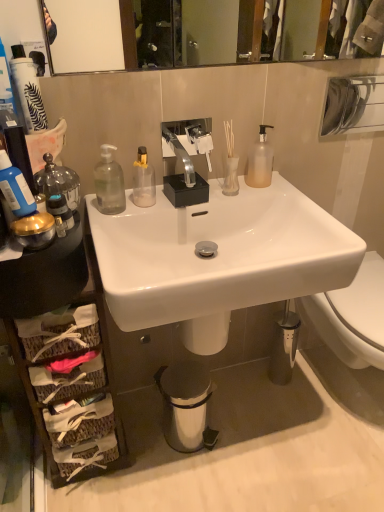
Locate an element on the screen. The height and width of the screenshot is (512, 384). vacant space in front of frosted glass pump bottle at upper right, the third bottle positioned from the front is located at coordinates (276, 196).